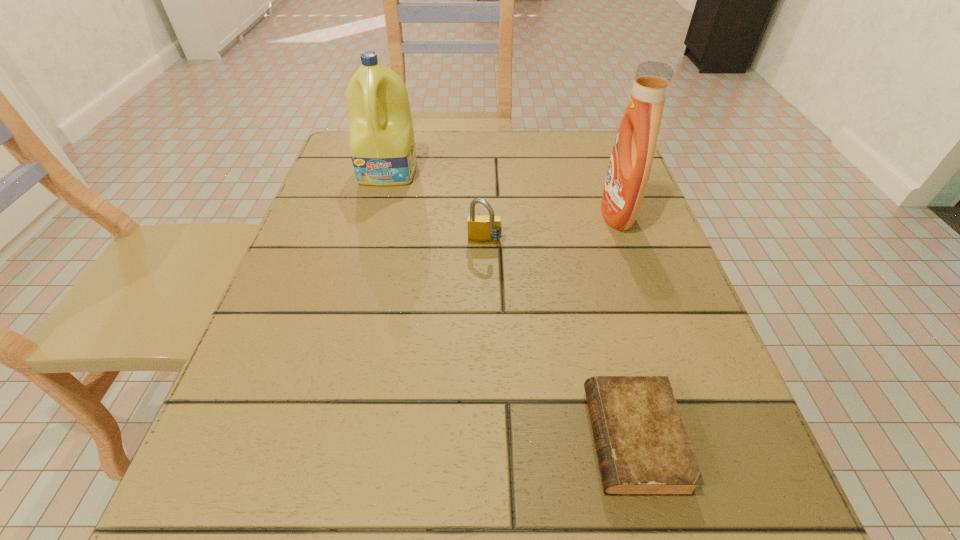
Where is `object located at the far left corner`? The width and height of the screenshot is (960, 540). object located at the far left corner is located at coordinates (382, 147).

This screenshot has height=540, width=960. In order to click on object situated at the near right corner in this screenshot , I will do `click(643, 449)`.

The width and height of the screenshot is (960, 540). What are the coordinates of `vacant space at the far edge` in the screenshot? It's located at (516, 148).

Where is `free space at the near edge of the desktop`? The width and height of the screenshot is (960, 540). free space at the near edge of the desktop is located at coordinates (460, 487).

The image size is (960, 540). In the image, there is a desktop. Find the location of `vacant space at the left edge`. vacant space at the left edge is located at coordinates (328, 358).

The height and width of the screenshot is (540, 960). In the image, there is a desktop. Identify the location of free space at the right edge. (765, 472).

This screenshot has width=960, height=540. I want to click on blank space at the near left corner, so click(222, 528).

In the image, there is a desktop. At what (x,y) coordinates should I click in order to perform the action: click on vacant space at the far right corner. Please return your answer as a coordinate pair (x, y). The image size is (960, 540). Looking at the image, I should click on (612, 131).

Where is `vacant space at the near right corner of the desktop`? The image size is (960, 540). vacant space at the near right corner of the desktop is located at coordinates (713, 497).

This screenshot has width=960, height=540. What are the coordinates of `empty location between the nearer detergent and the diary` in the screenshot? It's located at (625, 326).